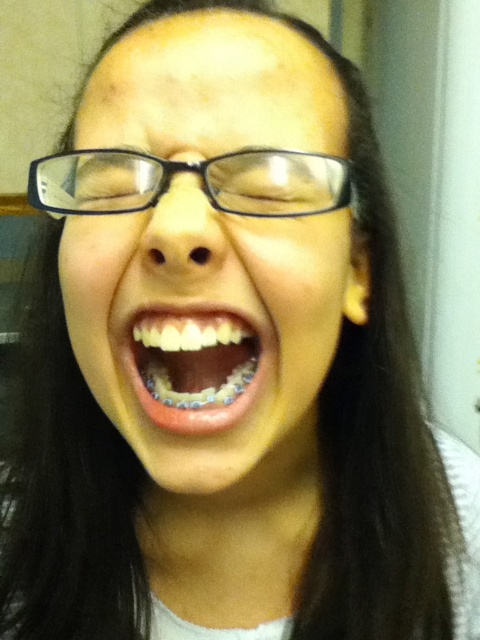
Does clear plastic glasses at center appear on the left side of white glossy teeth at center?

In fact, clear plastic glasses at center is to the right of white glossy teeth at center.

Does clear plastic glasses at center appear on the right side of white glossy teeth at center?

Indeed, clear plastic glasses at center is positioned on the right side of white glossy teeth at center.

You are a GUI agent. You are given a task and a screenshot of the screen. Output one action in this format:
    pyautogui.click(x=<x>, y=<y>)
    Task: Click on the clear plastic glasses at center
    The height and width of the screenshot is (640, 480).
    Given the screenshot: What is the action you would take?
    pyautogui.click(x=207, y=332)